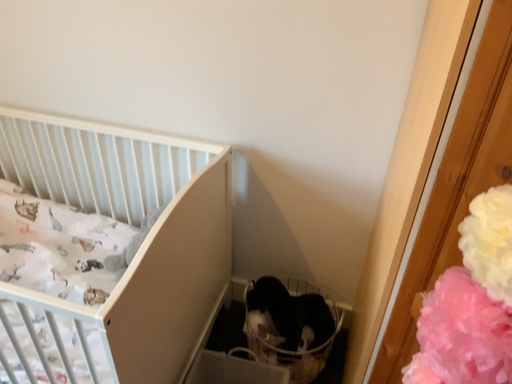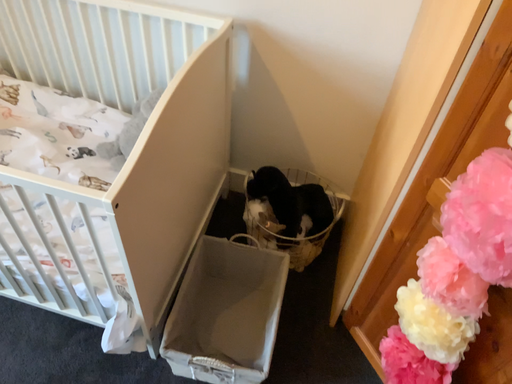
Question: Which way did the camera rotate in the video?

Choices:
 (A) rotated upward
 (B) rotated downward

Answer: (B)